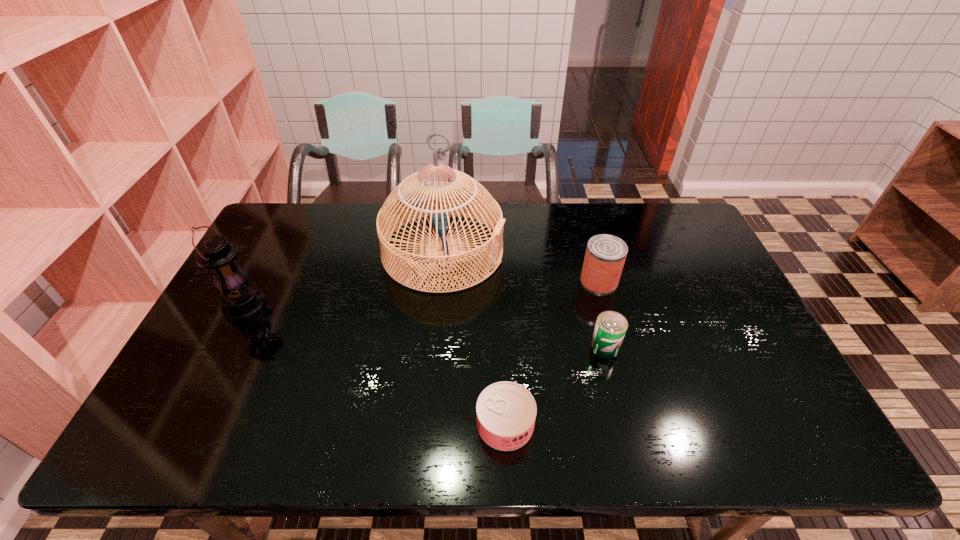
You are a GUI agent. You are given a task and a screenshot of the screen. Output one action in this format:
    pyautogui.click(x=<x>, y=<y>)
    Task: Click on the free point between the birdcage and the second nearest can
    The height and width of the screenshot is (540, 960).
    Given the screenshot: What is the action you would take?
    pyautogui.click(x=524, y=299)

This screenshot has height=540, width=960. What are the coordinates of `free spot between the shortest object and the tallest can` in the screenshot? It's located at (552, 353).

Identify the location of object that is the fourth closest to the tallest can. (240, 299).

Select which object appears as the fourth closest to the farthest can. Please provide its 2D coordinates. Your answer should be formatted as a tuple, i.e. [(x, y)], where the tuple contains the x and y coordinates of a point satisfying the conditions above.

[(240, 299)]

I want to click on can object that ranks as the second closest to the fourth shortest object, so click(611, 326).

Identify which can is the closest to the second shortest object. Please provide its 2D coordinates. Your answer should be formatted as a tuple, i.e. [(x, y)], where the tuple contains the x and y coordinates of a point satisfying the conditions above.

[(605, 256)]

This screenshot has height=540, width=960. Identify the location of blank area in the image that satisfies the following two spatial constraints: 1. on the back side of the second shortest can; 2. above the second tallest object, indicating its light source. [x=594, y=305].

At what (x,y) coordinates should I click in order to perform the action: click on free location that satisfies the following two spatial constraints: 1. above the lantern, indicating its light source; 2. on the back side of the nearest can. Please return your answer as a coordinate pair (x, y). The image size is (960, 540). Looking at the image, I should click on (185, 424).

At what (x,y) coordinates should I click in order to perform the action: click on blank space that satisfies the following two spatial constraints: 1. on the front side of the tallest object; 2. on the left side of the second tallest can. Please return your answer as a coordinate pair (x, y). Looking at the image, I should click on (434, 347).

At what (x,y) coordinates should I click in order to perform the action: click on free space that satisfies the following two spatial constraints: 1. on the front side of the birdcage; 2. above the fourth shortest object, indicating its light source. Please return your answer as a coordinate pair (x, y). The image size is (960, 540). Looking at the image, I should click on (438, 305).